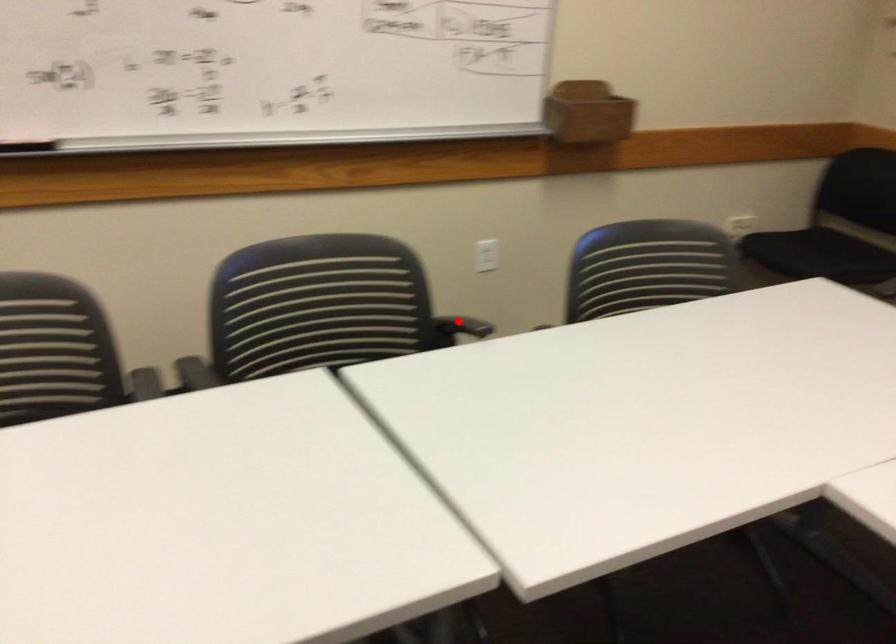
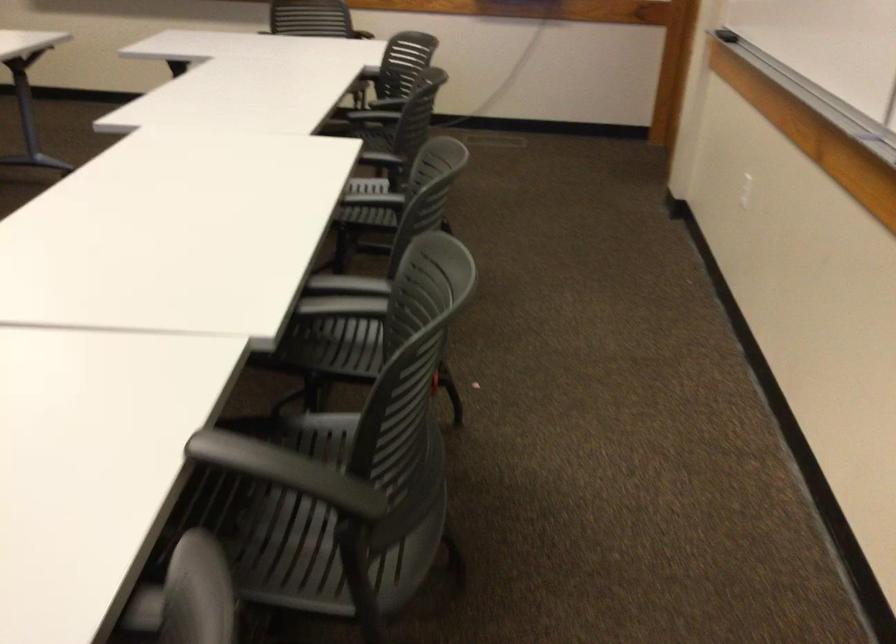
Question: I am providing you with two images of the same scene from different viewpoints. A red point is shown in image1. For the corresponding object point in image2, is it positioned nearer or farther from the camera?

Choices:
 (A) Nearer
 (B) Farther

Answer: (A)